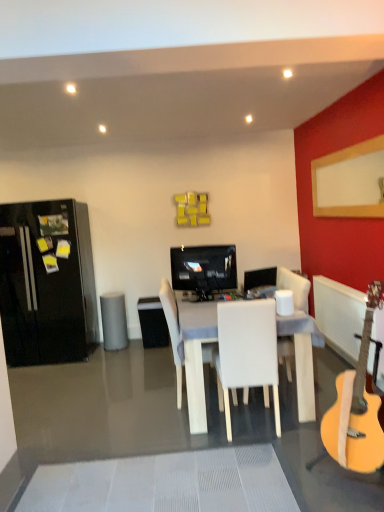
Question: Considering the relative sizes of black glossy refrigerator at left and white matte chair at center, which ranks as the first chair in front-to-back order, in the image provided, is black glossy refrigerator at left thinner than white matte chair at center, which ranks as the first chair in front-to-back order,?

Choices:
 (A) no
 (B) yes

Answer: (A)

Question: Is black glossy refrigerator at left positioned in front of white matte chair at center, marked as the second chair in a back-to-front arrangement?

Choices:
 (A) yes
 (B) no

Answer: (B)

Question: From the image's perspective, is black glossy refrigerator at left beneath white matte chair at center, marked as the second chair in a back-to-front arrangement?

Choices:
 (A) no
 (B) yes

Answer: (A)

Question: Is black glossy refrigerator at left bigger than white matte chair at center, marked as the second chair in a back-to-front arrangement?

Choices:
 (A) no
 (B) yes

Answer: (B)

Question: Could white matte chair at center, marked as the second chair in a back-to-front arrangement, be considered to be inside black glossy refrigerator at left?

Choices:
 (A) yes
 (B) no

Answer: (B)

Question: Considering the relative sizes of black glossy refrigerator at left and white matte chair at center, which ranks as the first chair in front-to-back order, in the image provided, is black glossy refrigerator at left wider than white matte chair at center, which ranks as the first chair in front-to-back order,?

Choices:
 (A) no
 (B) yes

Answer: (B)

Question: From the image's perspective, is matte black television at center under white plastic radiator at right?

Choices:
 (A) no
 (B) yes

Answer: (A)

Question: Can you confirm if matte black television at center is thinner than white plastic radiator at right?

Choices:
 (A) no
 (B) yes

Answer: (A)

Question: From a real-world perspective, is matte black television at center on top of white plastic radiator at right?

Choices:
 (A) no
 (B) yes

Answer: (B)

Question: Considering the relative sizes of matte black television at center and white plastic radiator at right in the image provided, is matte black television at center smaller than white plastic radiator at right?

Choices:
 (A) no
 (B) yes

Answer: (B)

Question: From the image's perspective, is matte black television at center on white plastic radiator at right?

Choices:
 (A) yes
 (B) no

Answer: (A)

Question: Is the depth of matte black television at center greater than that of white plastic radiator at right?

Choices:
 (A) no
 (B) yes

Answer: (B)

Question: Can you confirm if gray matte trash bin/can at center is wider than matte black television at center?

Choices:
 (A) no
 (B) yes

Answer: (B)